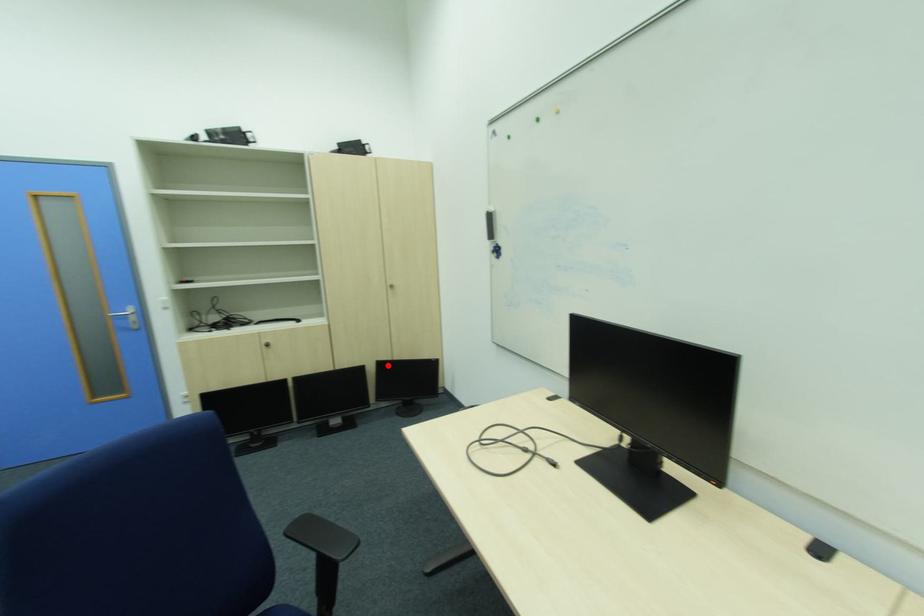
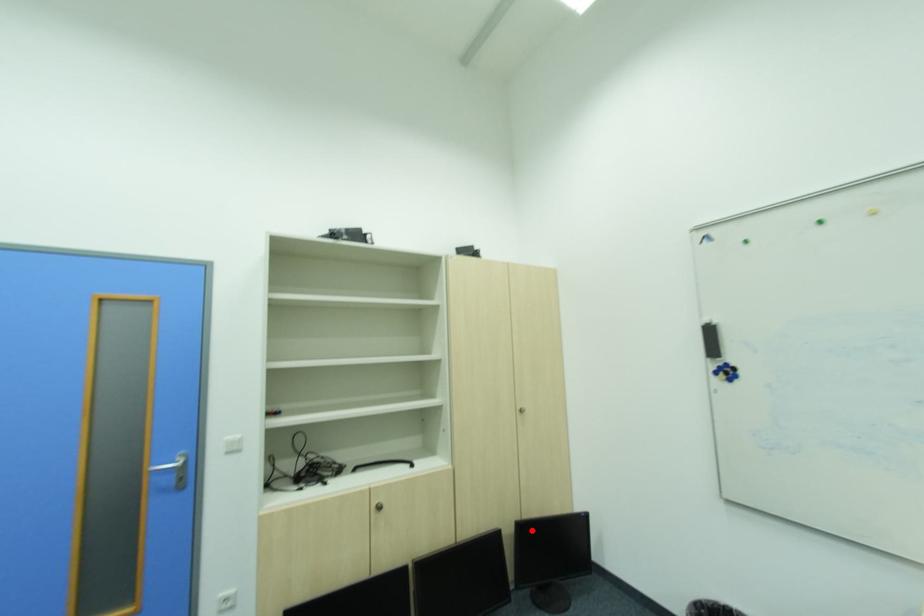
I am providing you with two images of the same scene from different viewpoints. A red point is marked on the first image and another point is marked on the second image. Are the points marked in image1 and image2 representing the same 3D position?

Yes